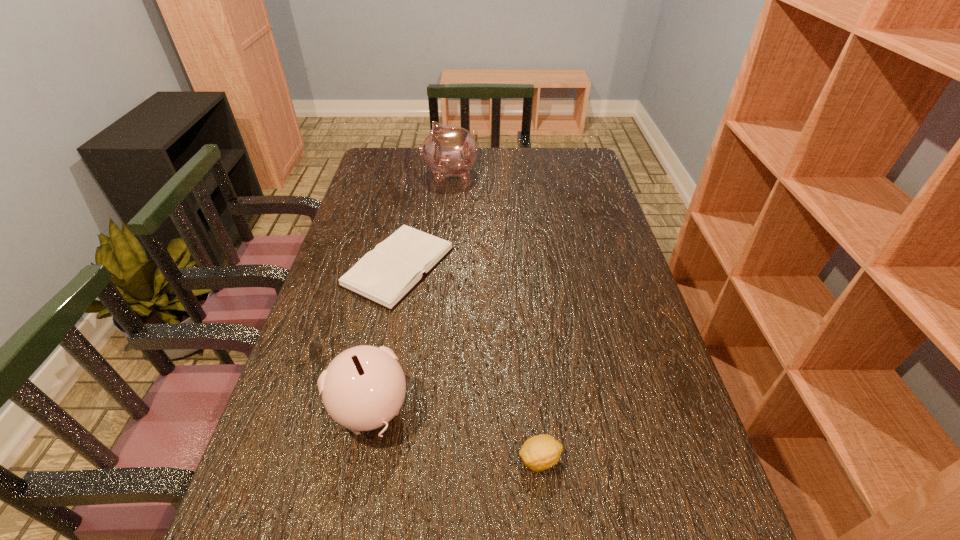
Identify the location of free space located 0.100m on the front facing side of the tallest object. The width and height of the screenshot is (960, 540). (395, 174).

Find the location of a particular element. free location located 0.190m on the right of the shorter piggy bank is located at coordinates (500, 410).

Find the location of `free space located at the stem end of the third tallest object`. free space located at the stem end of the third tallest object is located at coordinates (487, 460).

The image size is (960, 540). I want to click on free location located at the stem end of the third tallest object, so click(x=476, y=460).

You are a GUI agent. You are given a task and a screenshot of the screen. Output one action in this format:
    pyautogui.click(x=<x>, y=<y>)
    Task: Click on the free space located at the stem end of the third tallest object
    The width and height of the screenshot is (960, 540).
    Given the screenshot: What is the action you would take?
    pyautogui.click(x=331, y=460)

The height and width of the screenshot is (540, 960). I want to click on free region located on the front of the shortest object, so click(x=360, y=456).

You are a GUI agent. You are given a task and a screenshot of the screen. Output one action in this format:
    pyautogui.click(x=<x>, y=<y>)
    Task: Click on the object situated at the far edge
    The image size is (960, 540).
    Given the screenshot: What is the action you would take?
    pyautogui.click(x=449, y=151)

Locate an element on the screen. This screenshot has height=540, width=960. piggy bank present at the left edge is located at coordinates (363, 388).

Where is `hardback book that is positioned at the left edge`? hardback book that is positioned at the left edge is located at coordinates (385, 275).

Locate an element on the screen. The image size is (960, 540). vacant space at the far edge of the desktop is located at coordinates (530, 167).